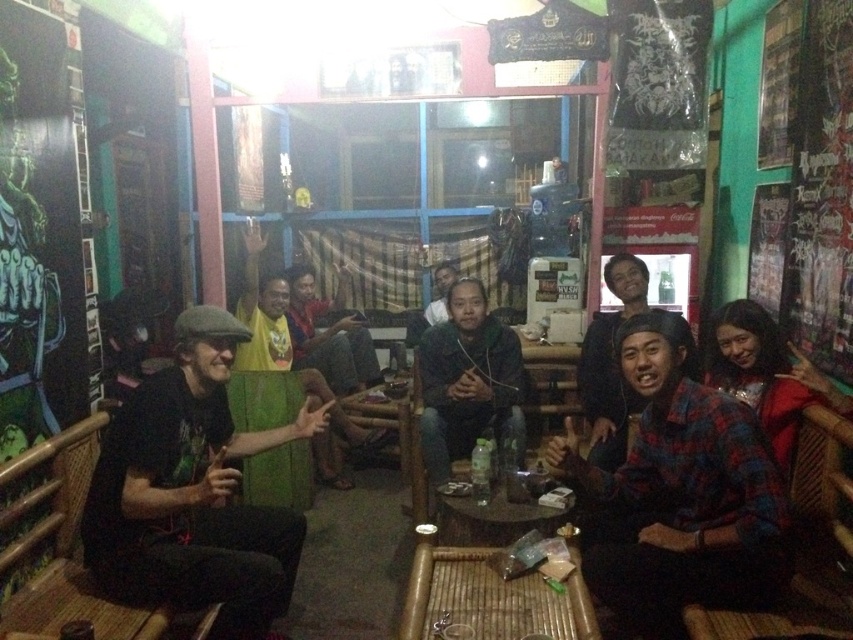
Based on the photo, does bamboo tray at center come behind matte black shirt at center?

No.

Is bamboo tray at center to the left of matte black shirt at center from the viewer's perspective?

In fact, bamboo tray at center is to the right of matte black shirt at center.

Does point (566, 628) come farther from viewer compared to point (314, 337)?

No, it is in front of (314, 337).

At what (x,y) coordinates should I click in order to perform the action: click on bamboo tray at center. Please return your answer as a coordinate pair (x, y). Looking at the image, I should click on point(489,596).

Is black matte shirt at left behind dark green fabric at center?

No.

Looking at this image, between black matte shirt at left and dark green fabric at center, which one is positioned higher?

dark green fabric at center

Does point (91, 561) come behind point (512, 416)?

No, it is not.

Locate an element on the screen. Image resolution: width=853 pixels, height=640 pixels. black matte shirt at left is located at coordinates (192, 492).

Can you confirm if dark green fabric at center is wider than red plaid shirt at lower right?

Correct, the width of dark green fabric at center exceeds that of red plaid shirt at lower right.

Who is more distant from viewer, (509, 396) or (755, 358)?

Point (509, 396)

Where is `dark green fabric at center`? dark green fabric at center is located at coordinates (467, 380).